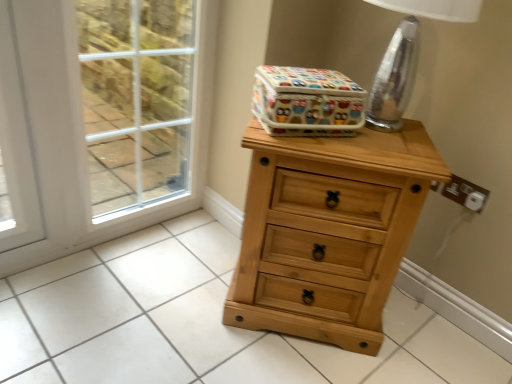
Where is `blank space situated above natural wood chest of drawers at center (from a real-world perspective)`? Image resolution: width=512 pixels, height=384 pixels. blank space situated above natural wood chest of drawers at center (from a real-world perspective) is located at coordinates (368, 138).